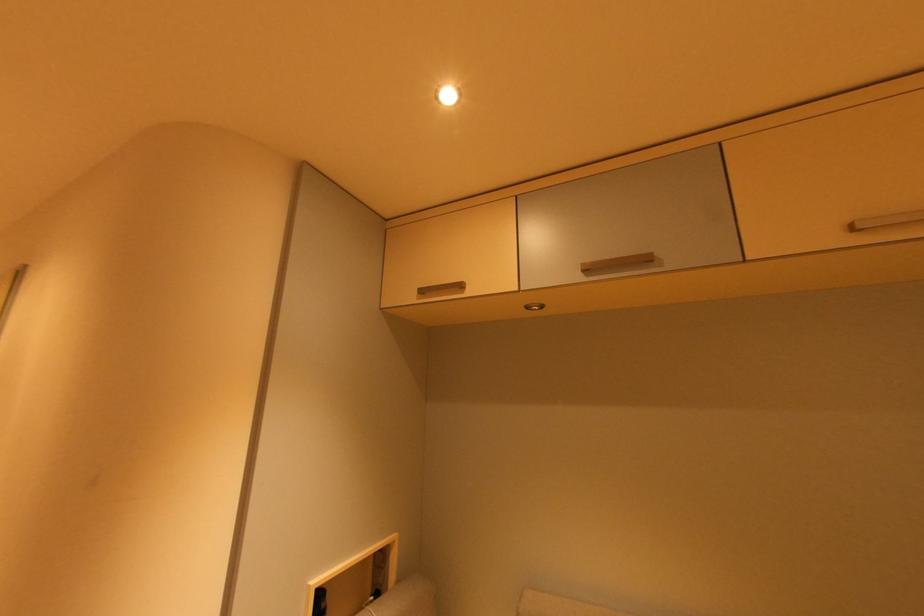
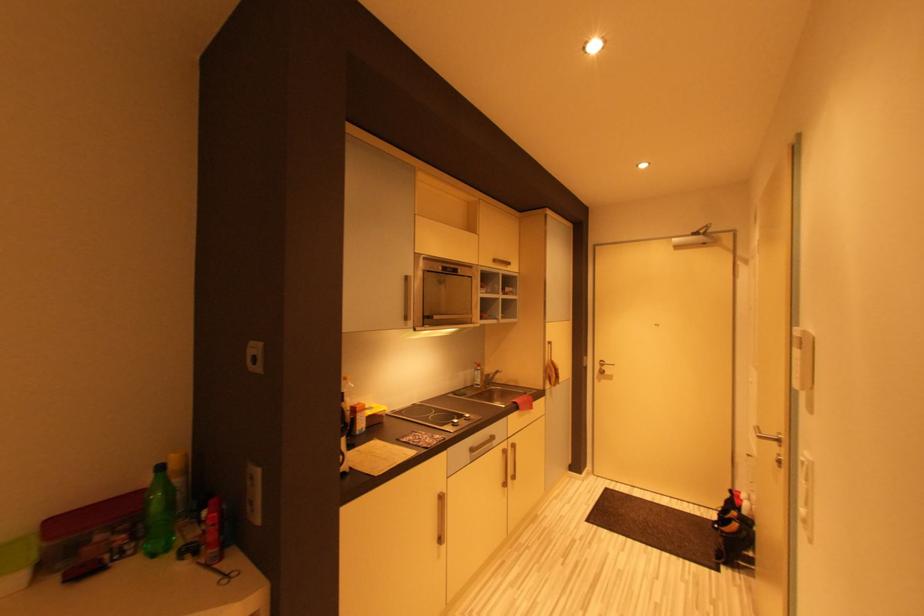
Question: The images are taken continuously from a first-person perspective. In which direction is your viewpoint rotating?

Choices:
 (A) Left
 (B) Right
 (C) Up
 (D) Down

Answer: (A)